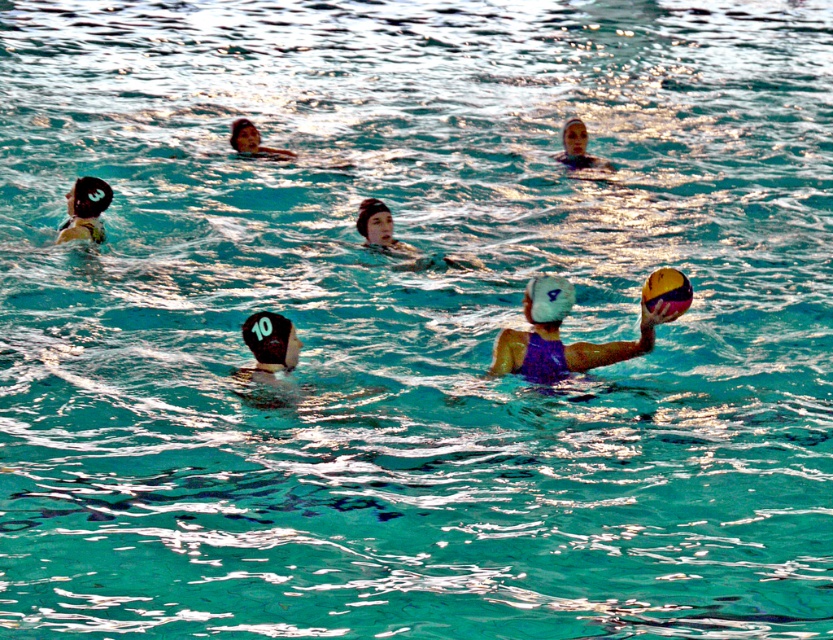
Does purple matte swimsuit at center have a smaller size compared to matte blue swim cap at upper center?

Actually, purple matte swimsuit at center might be larger than matte blue swim cap at upper center.

Is point (636, 342) positioned in front of point (569, 154)?

Yes, it is.

You are a GUI agent. You are given a task and a screenshot of the screen. Output one action in this format:
    pyautogui.click(x=<x>, y=<y>)
    Task: Click on the purple matte swimsuit at center
    The width and height of the screenshot is (833, 640).
    Given the screenshot: What is the action you would take?
    pyautogui.click(x=557, y=337)

Between purple matte swimsuit at center and black matte swim cap at upper left, which one appears on the left side from the viewer's perspective?

From the viewer's perspective, black matte swim cap at upper left appears more on the left side.

At what (x,y) coordinates should I click in order to perform the action: click on purple matte swimsuit at center. Please return your answer as a coordinate pair (x, y). This screenshot has height=640, width=833. Looking at the image, I should click on (557, 337).

Which of these two, purple matte swimsuit at center or matte blue swim cap at center, stands taller?

purple matte swimsuit at center is taller.

Between point (649, 323) and point (382, 202), which one is positioned in front?

Point (649, 323) is in front.

Between point (552, 289) and point (412, 244), which one is positioned behind?

The point (412, 244) is behind.

Locate an element on the screen. The image size is (833, 640). purple matte swimsuit at center is located at coordinates (557, 337).